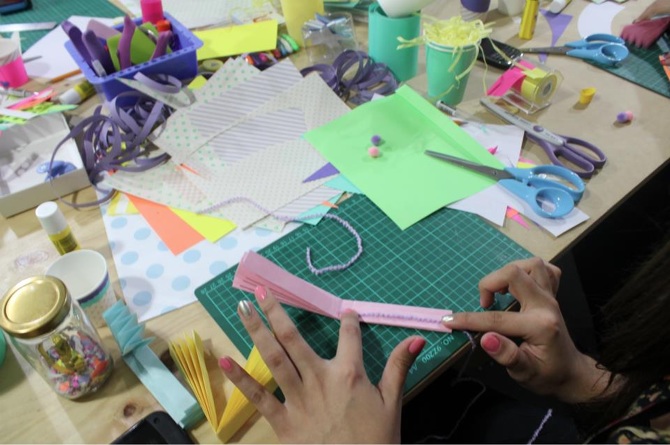
You are a GUI agent. You are given a task and a screenshot of the screen. Output one action in this format:
    pyautogui.click(x=<x>, y=<y>)
    Task: Click on the jar
    The height and width of the screenshot is (445, 670).
    Given the screenshot: What is the action you would take?
    63,350